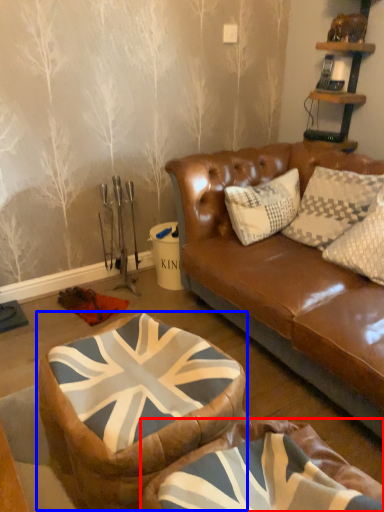
Question: Which object is closer to the camera taking this photo, bean bag chair (highlighted by a red box) or bean bag chair (highlighted by a blue box)?

Choices:
 (A) bean bag chair
 (B) bean bag chair

Answer: (A)